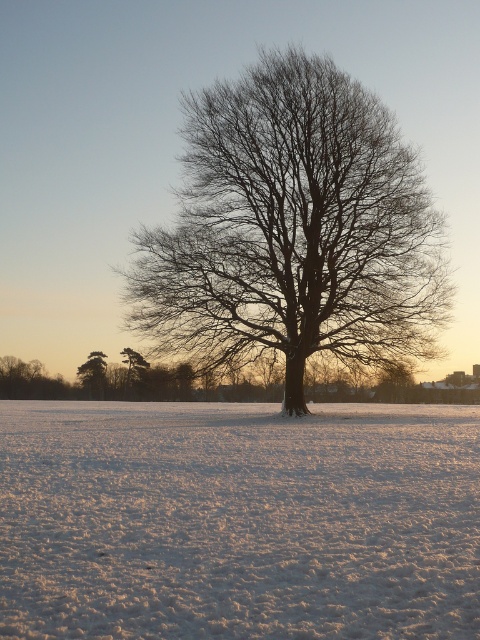
Looking at this image, you are standing in the winter scene and want to walk from the point at coordinates point (146, 326) to the point at coordinates point (91, 353). Which direction should you face to move towards the second point?

Since point (146, 326) is closer to the viewer than point (91, 353), you should face downwards to move towards the second point.

You are standing at the point with coordinates point [88,392] and want to walk to the point [467,628]. Based on the scene description, will you be walking towards or away from the large leafless tree in the center?

Since point [467,628] is in front of point [88,392], you would be walking towards the large leafless tree in the center.